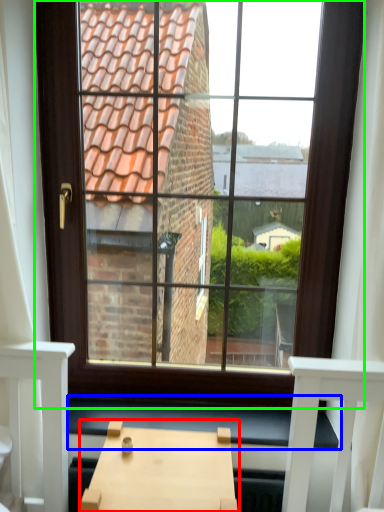
Question: Considering the real-world distances, which object is closest to table (highlighted by a red box)? window sill (highlighted by a blue box) or window (highlighted by a green box).

Choices:
 (A) window sill
 (B) window

Answer: (A)